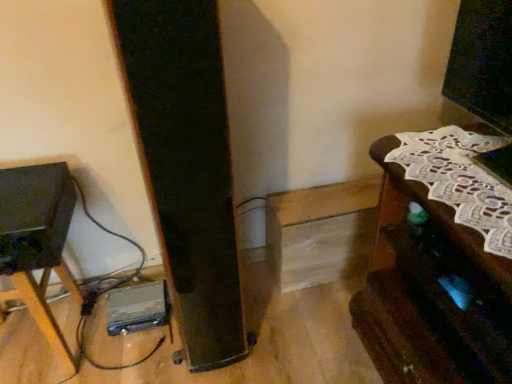
Where is `brown wooden table at right, which is the second furniture from left to right`? This screenshot has height=384, width=512. brown wooden table at right, which is the second furniture from left to right is located at coordinates (431, 292).

The height and width of the screenshot is (384, 512). What do you see at coordinates (37, 240) in the screenshot?
I see `metallic silver tripod at lower left, the 1th furniture positioned from the left` at bounding box center [37, 240].

In order to face matte black speaker at left, should I rotate leftwards or rightwards?

It's best to rotate left around 29.205 degrees.

The image size is (512, 384). Identify the location of brown wooden table at right, the first furniture positioned from the right. (431, 292).

Considering the positions of point (29, 268) and point (57, 230), is point (29, 268) closer or farther from the camera than point (57, 230)?

Point (29, 268) appears to be farther away from the viewer than point (57, 230).

In the scene shown: In terms of width, does matte black speaker at left look wider or thinner when compared to metallic silver tripod at lower left, the 1th furniture positioned from the left?

matte black speaker at left is wider than metallic silver tripod at lower left, the 1th furniture positioned from the left.

From a real-world perspective, is matte black speaker at left positioned above or below metallic silver tripod at lower left, the 1th furniture positioned from the left?

In terms of real-world spatial position, matte black speaker at left is above metallic silver tripod at lower left, the 1th furniture positioned from the left.

From the picture: Between matte black speaker at left and metallic silver tripod at lower left, the 2th furniture viewed from the right, which one has less height?

matte black speaker at left.

Is brown wooden table at right, the first furniture positioned from the right, outside of matte black speaker at left?

Yes, brown wooden table at right, the first furniture positioned from the right, is outside of matte black speaker at left.

What are the coordinates of `furniture on the right of the matte black speaker at left` in the screenshot? It's located at (431, 292).

Is brown wooden table at right, the first furniture positioned from the right, further to camera compared to matte black speaker at left?

No, brown wooden table at right, the first furniture positioned from the right, is closer to the viewer.

From a real-world perspective, is brown wooden table at right, the first furniture positioned from the right, physically below matte black speaker at left?

Yes, from a real-world perspective, brown wooden table at right, the first furniture positioned from the right, is beneath matte black speaker at left.

Is brown wooden table at right, which is the second furniture from left to right, facing away from metallic silver tripod at lower left, the 2th furniture viewed from the right?

No, brown wooden table at right, which is the second furniture from left to right,'s orientation is not away from metallic silver tripod at lower left, the 2th furniture viewed from the right.

From a real-world perspective, is brown wooden table at right, which is the second furniture from left to right, on top of metallic silver tripod at lower left, the 2th furniture viewed from the right?

Yes.

From the picture: Who is shorter, brown wooden table at right, the first furniture positioned from the right, or metallic silver tripod at lower left, the 2th furniture viewed from the right?

With less height is metallic silver tripod at lower left, the 2th furniture viewed from the right.

Is brown wooden table at right, the first furniture positioned from the right, completely or partially outside of metallic silver tripod at lower left, the 2th furniture viewed from the right?

Yes, brown wooden table at right, the first furniture positioned from the right, is outside of metallic silver tripod at lower left, the 2th furniture viewed from the right.

Can you tell me how much metallic silver tripod at lower left, the 1th furniture positioned from the left, and brown wooden table at right, the first furniture positioned from the right, differ in facing direction?

They differ by 92 degrees in their facing directions.

Which object is closer to the camera taking this photo, metallic silver tripod at lower left, the 2th furniture viewed from the right, or brown wooden table at right, which is the second furniture from left to right?

brown wooden table at right, which is the second furniture from left to right, is in front.

In the scene shown: From the image's perspective, is metallic silver tripod at lower left, the 1th furniture positioned from the left, located above brown wooden table at right, the first furniture positioned from the right?

No, from the image's perspective, metallic silver tripod at lower left, the 1th furniture positioned from the left, is not above brown wooden table at right, the first furniture positioned from the right.

Find the location of `furniture behind the brown wooden table at right, which is the second furniture from left to right`. furniture behind the brown wooden table at right, which is the second furniture from left to right is located at coordinates (37, 240).

Between metallic silver tripod at lower left, the 2th furniture viewed from the right, and matte black speaker at left, which one has smaller width?

With smaller width is metallic silver tripod at lower left, the 2th furniture viewed from the right.

Is metallic silver tripod at lower left, the 2th furniture viewed from the right, placed right next to matte black speaker at left?

Yes, metallic silver tripod at lower left, the 2th furniture viewed from the right, is with matte black speaker at left.

Is metallic silver tripod at lower left, the 1th furniture positioned from the left, inside or outside of matte black speaker at left?

metallic silver tripod at lower left, the 1th furniture positioned from the left, lies outside matte black speaker at left.

Which is behind, metallic silver tripod at lower left, the 2th furniture viewed from the right, or matte black speaker at left?

metallic silver tripod at lower left, the 2th furniture viewed from the right, is behind.

Identify the location of furniture in front of the matte black speaker at left. The height and width of the screenshot is (384, 512). (431, 292).

Is matte black speaker at left situated inside brown wooden table at right, which is the second furniture from left to right, or outside?

matte black speaker at left cannot be found inside brown wooden table at right, which is the second furniture from left to right.

Is matte black speaker at left wider than brown wooden table at right, the first furniture positioned from the right?

No, matte black speaker at left is not wider than brown wooden table at right, the first furniture positioned from the right.

From a real-world perspective, does matte black speaker at left stand above brown wooden table at right, which is the second furniture from left to right?

Yes.

Where is `speaker lying in front of the metallic silver tripod at lower left, the 1th furniture positioned from the left`? This screenshot has height=384, width=512. speaker lying in front of the metallic silver tripod at lower left, the 1th furniture positioned from the left is located at coordinates (34, 216).

Identify the location of speaker above the brown wooden table at right, which is the second furniture from left to right (from a real-world perspective). This screenshot has height=384, width=512. (34, 216).

Based on the photo, based on their spatial positions, is metallic silver tripod at lower left, the 2th furniture viewed from the right, or matte black speaker at left closer to brown wooden table at right, which is the second furniture from left to right?

matte black speaker at left is positioned closer to the anchor brown wooden table at right, which is the second furniture from left to right.

Which object lies nearer to the anchor point brown wooden table at right, which is the second furniture from left to right, matte black speaker at left or metallic silver tripod at lower left, the 1th furniture positioned from the left?

Among the two, matte black speaker at left is located nearer to brown wooden table at right, which is the second furniture from left to right.

From the image, which object appears to be farther from metallic silver tripod at lower left, the 1th furniture positioned from the left, matte black speaker at left or brown wooden table at right, the first furniture positioned from the right?

Among the two, brown wooden table at right, the first furniture positioned from the right, is located further to metallic silver tripod at lower left, the 1th furniture positioned from the left.

Considering their positions, is brown wooden table at right, the first furniture positioned from the right, positioned further to metallic silver tripod at lower left, the 1th furniture positioned from the left, than matte black speaker at left?

brown wooden table at right, the first furniture positioned from the right, lies further to metallic silver tripod at lower left, the 1th furniture positioned from the left, than the other object.

In the scene shown: Which object lies further to the anchor point matte black speaker at left, metallic silver tripod at lower left, the 2th furniture viewed from the right, or brown wooden table at right, which is the second furniture from left to right?

The object further to matte black speaker at left is brown wooden table at right, which is the second furniture from left to right.

From the image, which object appears to be farther from matte black speaker at left, brown wooden table at right, which is the second furniture from left to right, or metallic silver tripod at lower left, the 1th furniture positioned from the left?

brown wooden table at right, which is the second furniture from left to right, is positioned further to the anchor matte black speaker at left.

Locate an element on the screen. speaker situated between metallic silver tripod at lower left, the 1th furniture positioned from the left, and brown wooden table at right, the first furniture positioned from the right, from left to right is located at coordinates (34, 216).